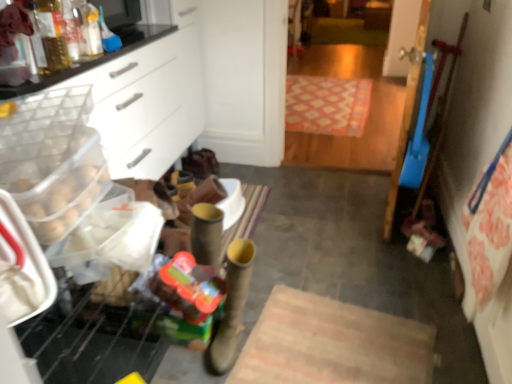
The height and width of the screenshot is (384, 512). What do you see at coordinates (189, 287) in the screenshot?
I see `translucent plastic toy at lower left` at bounding box center [189, 287].

In order to face leather boot at center, should I rotate leftwards or rightwards?

You should rotate left by 2.452 degrees.

The height and width of the screenshot is (384, 512). What do you see at coordinates (327, 105) in the screenshot?
I see `patterned carpet at center` at bounding box center [327, 105].

Measure the distance between point (39, 25) and camera.

Point (39, 25) is 4.37 feet from camera.

The image size is (512, 384). What do you see at coordinates (52, 34) in the screenshot?
I see `translucent plastic bottle at upper left` at bounding box center [52, 34].

Where is `translucent plastic toy at lower left`? Image resolution: width=512 pixels, height=384 pixels. translucent plastic toy at lower left is located at coordinates (189, 287).

Is translucent plastic bottle at upper left bigger or smaller than patterned carpet at center?

In the image, translucent plastic bottle at upper left appears to be smaller than patterned carpet at center.

Find the location of `bottle above the patterned carpet at center (from a real-world perspective)`. bottle above the patterned carpet at center (from a real-world perspective) is located at coordinates (52, 34).

Relative to patterned carpet at center, is translucent plastic bottle at upper left in front or behind?

Clearly, translucent plastic bottle at upper left is in front of patterned carpet at center.

Does translucent plastic bottle at upper left contain translucent plastic toy at lower left?

No, translucent plastic bottle at upper left does not contain translucent plastic toy at lower left.

Which is in front, point (57, 54) or point (172, 276)?

Point (57, 54)

Considering the relative sizes of translucent plastic bottle at upper left and translucent plastic toy at lower left in the image provided, is translucent plastic bottle at upper left thinner than translucent plastic toy at lower left?

Correct, the width of translucent plastic bottle at upper left is less than that of translucent plastic toy at lower left.

Considering the relative sizes of leather boot at center and white plastic drawer at left in the image provided, is leather boot at center bigger than white plastic drawer at left?

Incorrect, leather boot at center is not larger than white plastic drawer at left.

Identify the location of cabinetry above the leather boot at center (from the image's perspective). This screenshot has height=384, width=512. (150, 97).

Between leather boot at center and white plastic drawer at left, which one has smaller width?

leather boot at center is thinner.

Is leather boot at center next to white plastic drawer at left?

No, leather boot at center is not in contact with white plastic drawer at left.

In the scene shown: Is leather boot at center at the left side of patterned carpet at center?

Correct, you'll find leather boot at center to the left of patterned carpet at center.

From a real-world perspective, is leather boot at center under patterned carpet at center?

Actually, leather boot at center is physically above patterned carpet at center in the real world.

Is leather boot at center spatially inside patterned carpet at center, or outside of it?

leather boot at center lies outside patterned carpet at center.

Is patterned carpet at center in contact with translucent plastic bottle at upper left?

No, patterned carpet at center is not beside translucent plastic bottle at upper left.

Between patterned carpet at center and translucent plastic bottle at upper left, which one has smaller size?

translucent plastic bottle at upper left is smaller.

Is patterned carpet at center positioned before translucent plastic bottle at upper left?

No, patterned carpet at center is further to the viewer.

In the image, is leather boot at center positioned in front of or behind translucent plastic bottle at upper left?

Visually, leather boot at center is located in front of translucent plastic bottle at upper left.

Based on the photo, considering the relative positions of leather boot at center and translucent plastic bottle at upper left in the image provided, is leather boot at center to the left or to the right of translucent plastic bottle at upper left?

From the image, it's evident that leather boot at center is to the right of translucent plastic bottle at upper left.

Between leather boot at center and translucent plastic bottle at upper left, which one has smaller width?

translucent plastic bottle at upper left is thinner.

How many degrees apart are the facing directions of translucent plastic bottle at upper left and leather boot at center?

translucent plastic bottle at upper left and leather boot at center are facing 91.9 degrees away from each other.

From a real-world perspective, which is physically above, translucent plastic bottle at upper left or leather boot at center?

translucent plastic bottle at upper left.

The image size is (512, 384). Identify the location of footwear on the right side of translucent plastic bottle at upper left. (232, 306).

Identify the location of mat below the translucent plastic bottle at upper left (from a real-world perspective). (327, 105).

Locate an element on the screen. The height and width of the screenshot is (384, 512). bottle above the translucent plastic toy at lower left (from the image's perspective) is located at coordinates (52, 34).

Looking at the image, which one is located further to patterned carpet at center, white plastic drawer at left or translucent plastic bottle at upper left?

translucent plastic bottle at upper left is positioned further to the anchor patterned carpet at center.

Estimate the real-world distances between objects in this image. Which object is further from translucent plastic toy at lower left, leather boot at center or white plastic drawer at left?

white plastic drawer at left lies further to translucent plastic toy at lower left than the other object.

Based on their spatial positions, is leather boot at center or patterned carpet at center closer to white plastic drawer at left?

The object closer to white plastic drawer at left is leather boot at center.

When comparing their distances from leather boot at center, does white plastic drawer at left or patterned carpet at center seem further?

patterned carpet at center is further to leather boot at center.

When comparing their distances from white plastic drawer at left, does patterned carpet at center or leather boot at center seem closer?

Based on the image, leather boot at center appears to be nearer to white plastic drawer at left.

Based on their spatial positions, is translucent plastic toy at lower left or translucent plastic bottle at upper left closer to leather boot at center?

Among the two, translucent plastic toy at lower left is located nearer to leather boot at center.

When comparing their distances from patterned carpet at center, does translucent plastic toy at lower left or leather boot at center seem further?

Based on the image, translucent plastic toy at lower left appears to be further to patterned carpet at center.

From the image, which object appears to be farther from translucent plastic bottle at upper left, leather boot at center or white plastic drawer at left?

Based on the image, leather boot at center appears to be further to translucent plastic bottle at upper left.

Where is `bottle positioned between leather boot at center and patterned carpet at center from near to far`? The width and height of the screenshot is (512, 384). bottle positioned between leather boot at center and patterned carpet at center from near to far is located at coordinates (52, 34).

What are the coordinates of `stuff positioned between leather boot at center and patterned carpet at center from near to far` in the screenshot? It's located at (189, 287).

The width and height of the screenshot is (512, 384). In order to click on cabinetry that lies between translucent plastic bottle at upper left and translucent plastic toy at lower left from top to bottom in this screenshot , I will do `click(150, 97)`.

The image size is (512, 384). What are the coordinates of `stuff between translucent plastic bottle at upper left and patterned carpet at center along the z-axis` in the screenshot? It's located at (189, 287).